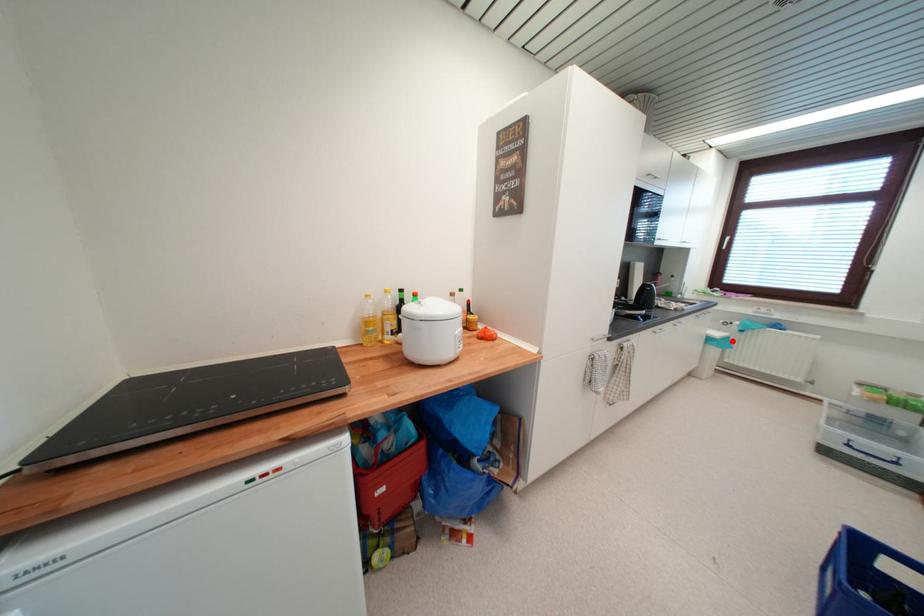
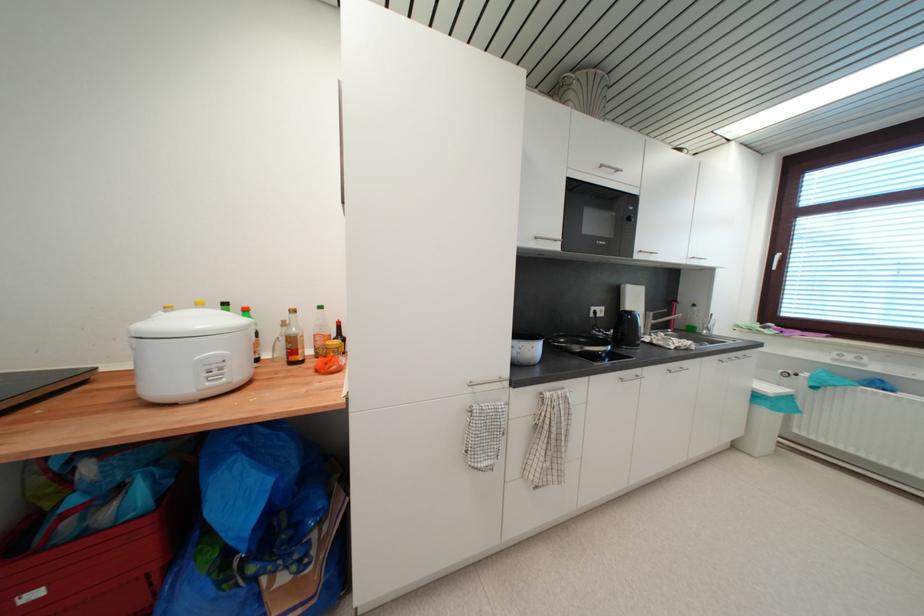
Question: I am providing you with two images of the same scene from different viewpoints. Given a red point in image1, look at the same physical point in image2. Is it:

Choices:
 (A) Closer to the viewpoint
 (B) Farther from the viewpoint

Answer: (A)